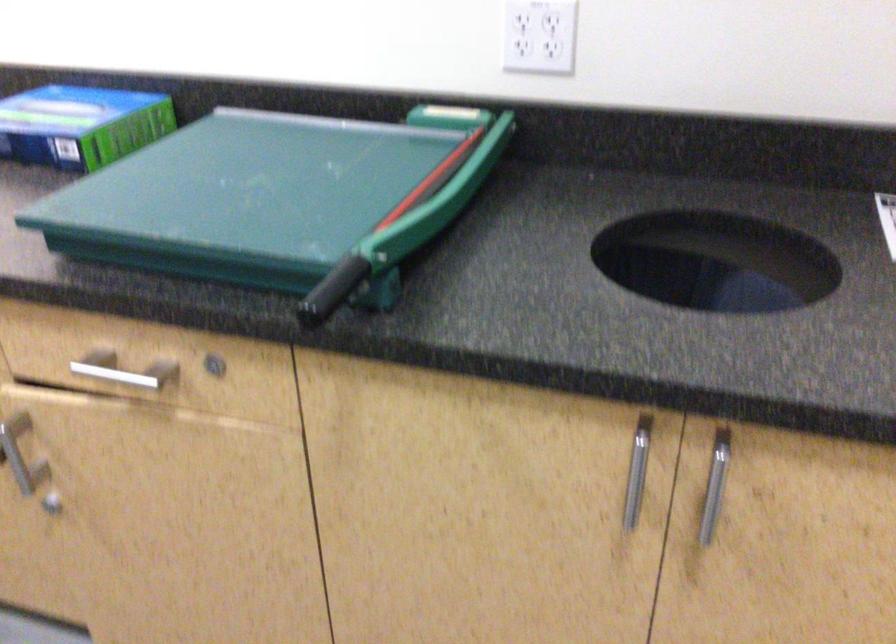
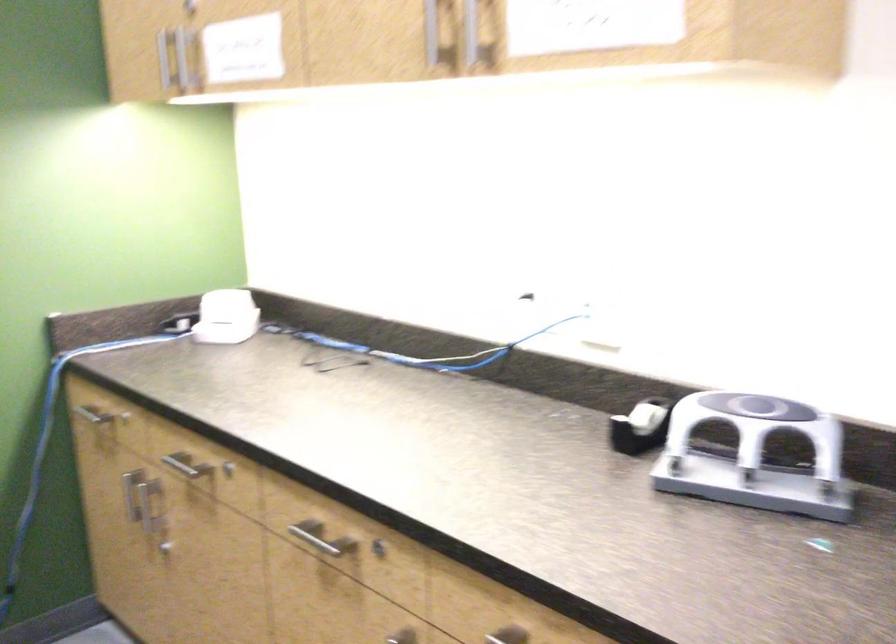
Question: How did the camera likely rotate?

Choices:
 (A) Left
 (B) Right
 (C) Up
 (D) Down

Answer: (A)